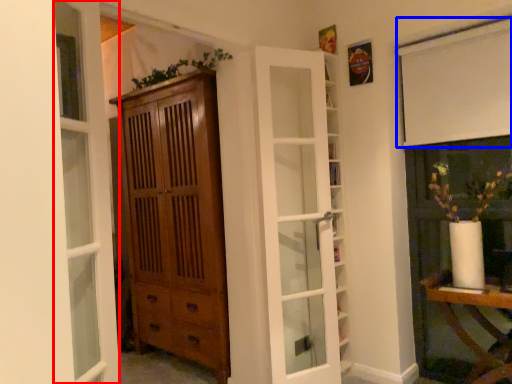
Question: Which point is further to the camera, window (highlighted by a red box) or curtain (highlighted by a blue box)?

Choices:
 (A) window
 (B) curtain

Answer: (B)